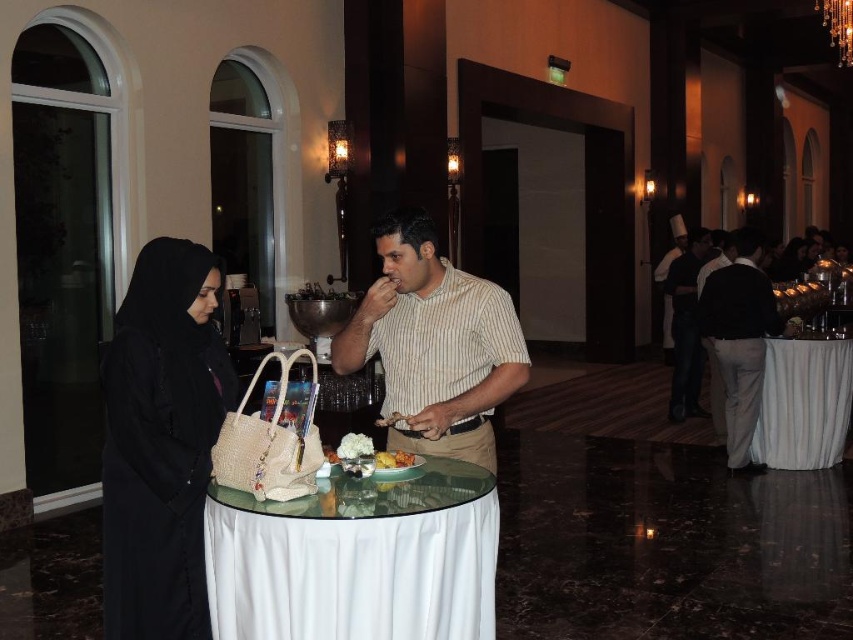
You are standing at the entrance of the banquet hall and see two points marked on the table. Which point is closer to you? The points are labeled as point 1 at coordinates (x=178, y=387) and point 2 at coordinates (x=827, y=452).

Point 1 at coordinates (x=178, y=387) is closer to you because it is in front of point 2 at coordinates (x=827, y=452).